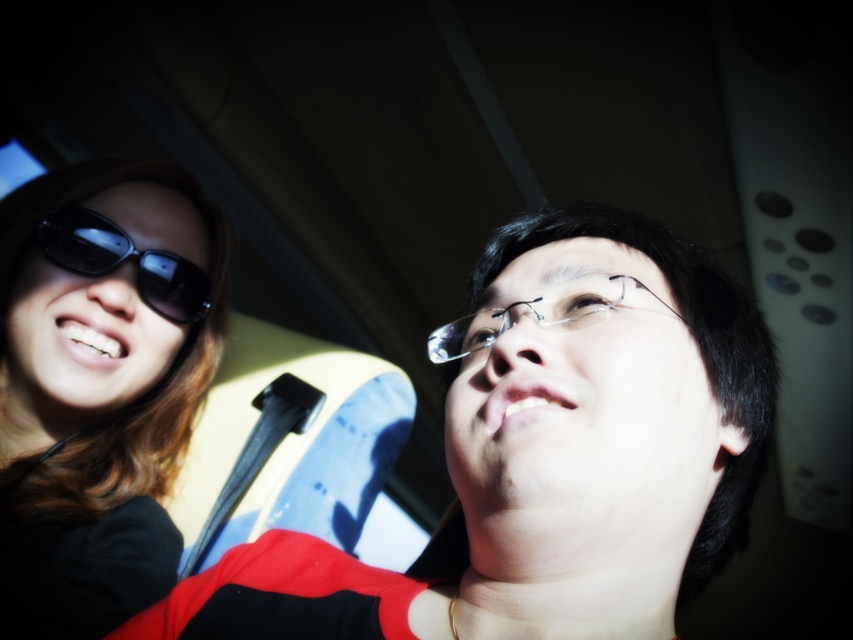
Question: Among these points, which one is farthest from the camera?

Choices:
 (A) (91, 237)
 (B) (49, 268)
 (C) (552, 312)

Answer: (A)

Question: Which object is closer to the camera taking this photo?

Choices:
 (A) matte black sunglasses at upper left
 (B) matte black sunglasses at left

Answer: (A)

Question: Is sunglasses at left positioned before matte black sunglasses at left?

Choices:
 (A) yes
 (B) no

Answer: (A)

Question: From the image, what is the correct spatial relationship of matte black sunglasses at upper left in relation to sunglasses at left?

Choices:
 (A) left
 (B) right

Answer: (B)

Question: Which object appears closest to the camera in this image?

Choices:
 (A) matte black sunglasses at upper left
 (B) clear plastic glasses at center
 (C) sunglasses at left
 (D) matte black sunglasses at left

Answer: (A)

Question: Is sunglasses at left smaller than matte black sunglasses at left?

Choices:
 (A) yes
 (B) no

Answer: (B)